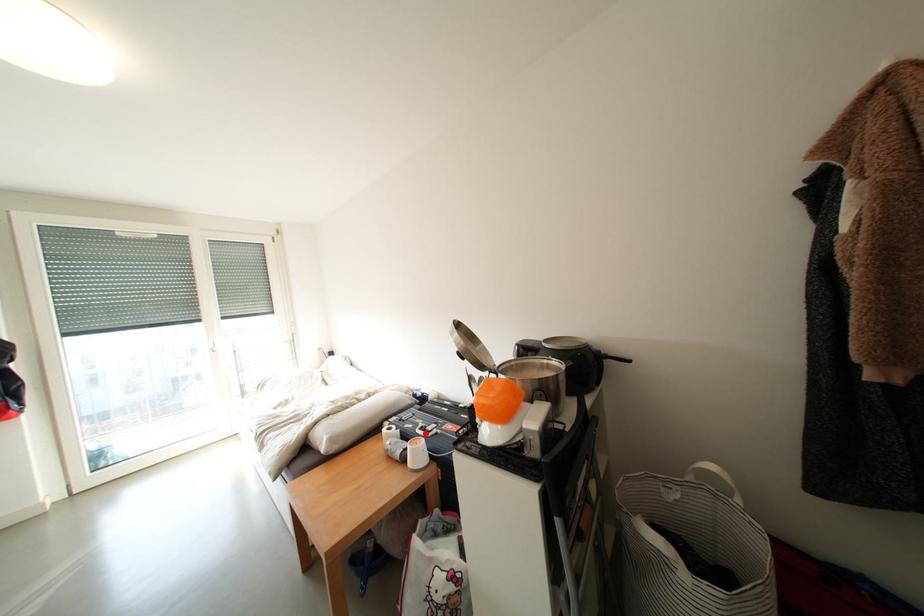
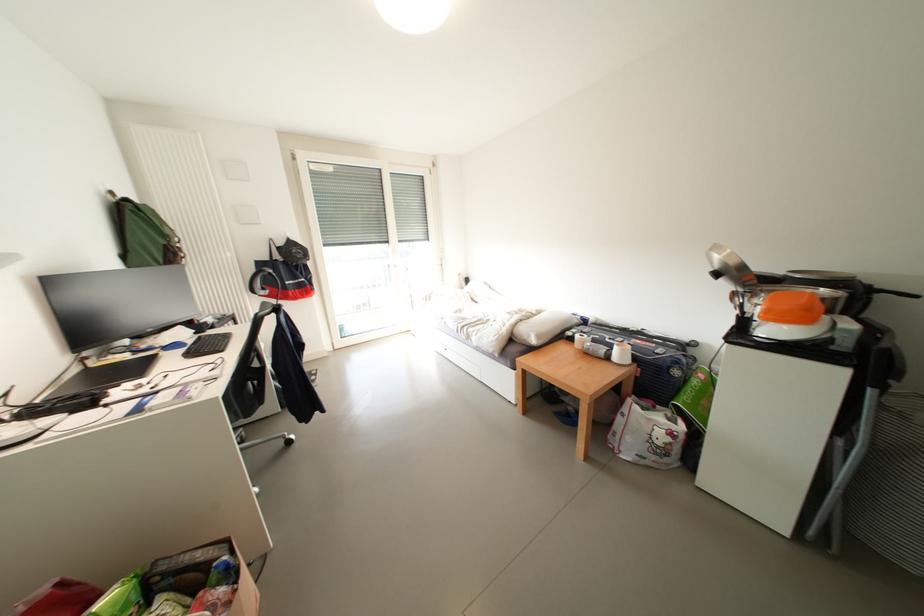
Find the pixel in the second image that matches the highlighted location in the first image.

(614, 342)